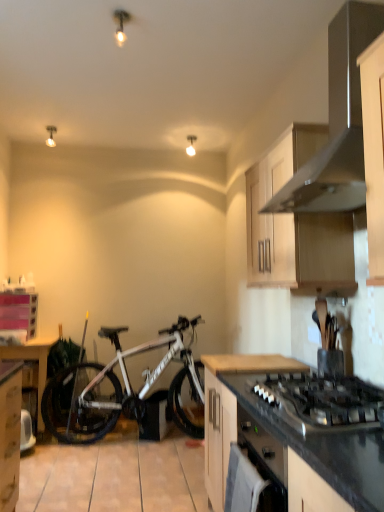
Question: Is there a large distance between black granite countertop at lower right, positioned as the second countertop in top-to-bottom order, and wooden cabinet at upper right, which is the 1th cabinetry in front-to-back order?

Choices:
 (A) yes
 (B) no

Answer: (B)

Question: Does black granite countertop at lower right, which ranks as the 1th countertop in bottom-to-top order, have a lesser height compared to wooden cabinet at upper right, the 2th cabinetry in the left-to-right sequence?

Choices:
 (A) no
 (B) yes

Answer: (A)

Question: Does black granite countertop at lower right, positioned as the second countertop in top-to-bottom order, touch wooden cabinet at upper right, acting as the first cabinetry starting from the top?

Choices:
 (A) no
 (B) yes

Answer: (A)

Question: From a real-world perspective, is black granite countertop at lower right, which ranks as the 1th countertop in bottom-to-top order, below wooden cabinet at upper right, acting as the first cabinetry starting from the top?

Choices:
 (A) no
 (B) yes

Answer: (B)

Question: Does black granite countertop at lower right, positioned as the second countertop in top-to-bottom order, have a greater width compared to wooden cabinet at upper right, which is counted as the 2th cabinetry, starting from the back?

Choices:
 (A) no
 (B) yes

Answer: (B)

Question: Considering the relative sizes of black granite countertop at lower right, positioned as the second countertop in top-to-bottom order, and wooden cabinet at upper right, which is counted as the 2th cabinetry, starting from the back, in the image provided, is black granite countertop at lower right, positioned as the second countertop in top-to-bottom order, smaller than wooden cabinet at upper right, which is counted as the 2th cabinetry, starting from the back,?

Choices:
 (A) yes
 (B) no

Answer: (B)

Question: From a real-world perspective, does black matte oven at lower center sit lower than black matte gas stove at lower right?

Choices:
 (A) no
 (B) yes

Answer: (B)

Question: Considering the relative positions of black matte oven at lower center and black matte gas stove at lower right in the image provided, is black matte oven at lower center in front of black matte gas stove at lower right?

Choices:
 (A) yes
 (B) no

Answer: (B)

Question: Considering the relative sizes of black matte oven at lower center and black matte gas stove at lower right in the image provided, is black matte oven at lower center bigger than black matte gas stove at lower right?

Choices:
 (A) yes
 (B) no

Answer: (B)

Question: Is black matte oven at lower center outside black matte gas stove at lower right?

Choices:
 (A) no
 (B) yes

Answer: (B)

Question: From the image's perspective, is black matte oven at lower center on black matte gas stove at lower right?

Choices:
 (A) no
 (B) yes

Answer: (A)

Question: Is black matte oven at lower center far from black matte gas stove at lower right?

Choices:
 (A) yes
 (B) no

Answer: (B)

Question: Is black granite countertop at lower right, which ranks as the 1th countertop in bottom-to-top order, located within wooden table at left?

Choices:
 (A) yes
 (B) no

Answer: (B)